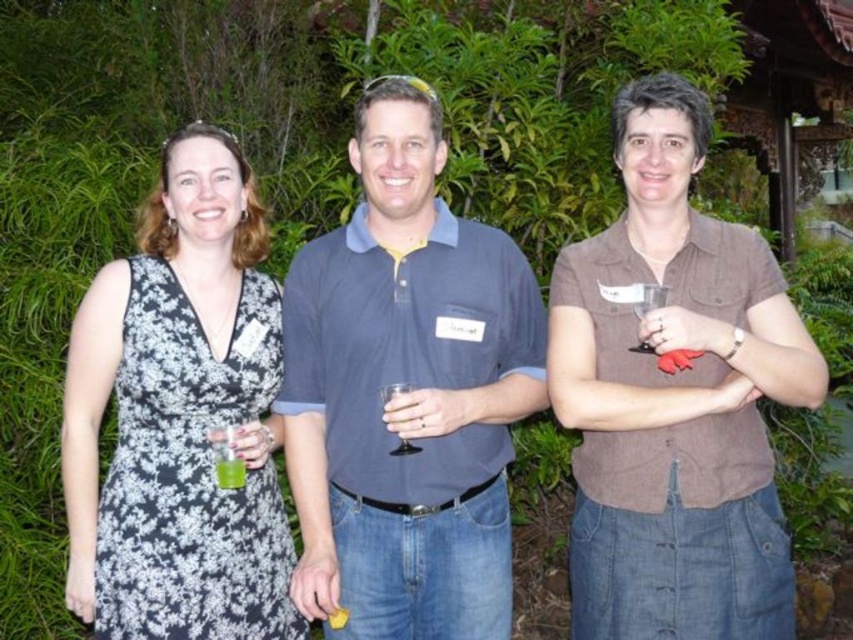
You are a bartender at the event and need to deliver a drink to the guest holding the green translucent cup at center. The blue cotton polo shirt at center is blocking your path. Can you walk around them without getting too close?

The blue cotton polo shirt at center is 1.18 meters away from the green translucent cup at center. Since the minimum safe distance for passing is typically around 0.7 meters, you can easily walk around the blue cotton polo shirt at center to reach the green translucent cup at center without getting too close.

You are a photographer at this event and need to capture a clear photo of the brown cotton shirt at right and the green translucent cup at center. Which object should you focus on first to ensure both are in focus?

The brown cotton shirt at right is closer to you than the green translucent cup at center, so you should focus on the brown cotton shirt at right first to ensure both are in focus.

You are at a party and see the blue cotton polo shirt at center and the green translucent cup at center. Which one is more to the right?

The blue cotton polo shirt at center is more to the right than the green translucent cup at center.